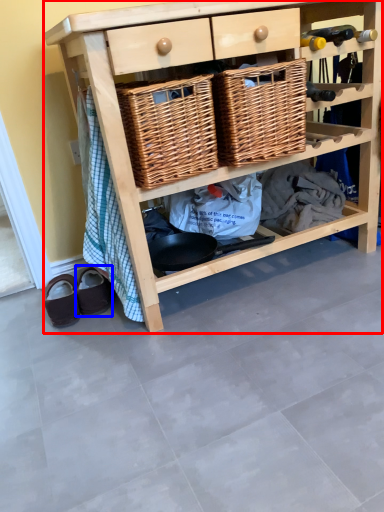
Question: Among these objects, which one is nearest to the camera, shelf (highlighted by a red box) or footwear (highlighted by a blue box)?

Choices:
 (A) shelf
 (B) footwear

Answer: (A)